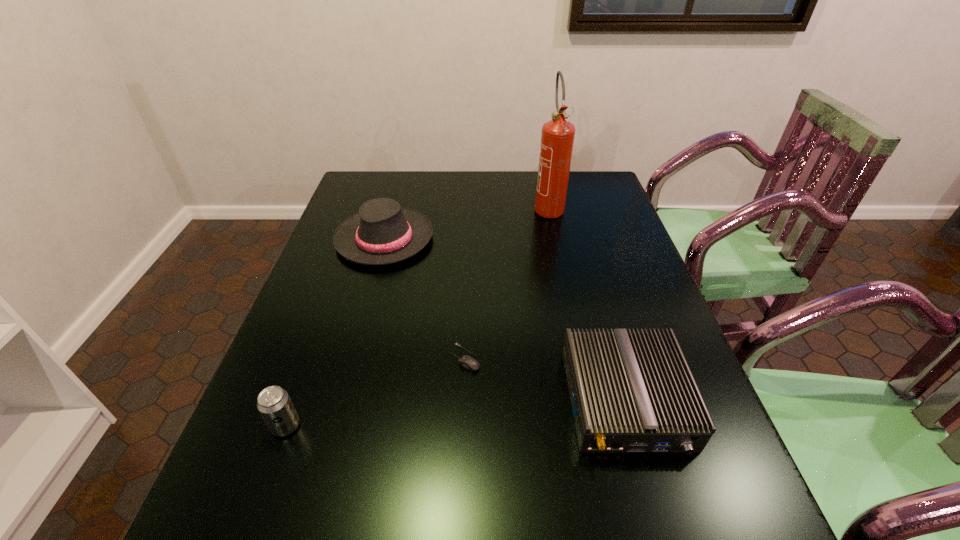
The height and width of the screenshot is (540, 960). I want to click on vacant space situated 0.180m on the left of the third object from right to left, so click(x=370, y=357).

Where is `object at the far edge`? Image resolution: width=960 pixels, height=540 pixels. object at the far edge is located at coordinates (557, 138).

Identify the location of dress hat that is at the left edge. This screenshot has width=960, height=540. (382, 232).

This screenshot has width=960, height=540. In order to click on beer can situated at the left edge in this screenshot , I will do `click(274, 404)`.

Find the location of `object that is at the right edge`. object that is at the right edge is located at coordinates (632, 391).

In the image, there is a desktop. At what (x,y) coordinates should I click in order to perform the action: click on vacant space at the far edge. Please return your answer as a coordinate pair (x, y). Image resolution: width=960 pixels, height=540 pixels. Looking at the image, I should click on (498, 174).

Locate an element on the screen. Image resolution: width=960 pixels, height=540 pixels. free space at the left edge is located at coordinates (276, 484).

Find the location of `blank space at the right edge`. blank space at the right edge is located at coordinates (712, 475).

Find the location of `vacant space at the far left corner of the desktop`. vacant space at the far left corner of the desktop is located at coordinates (364, 184).

I want to click on free space between the dress hat and the tallest object, so click(x=467, y=223).